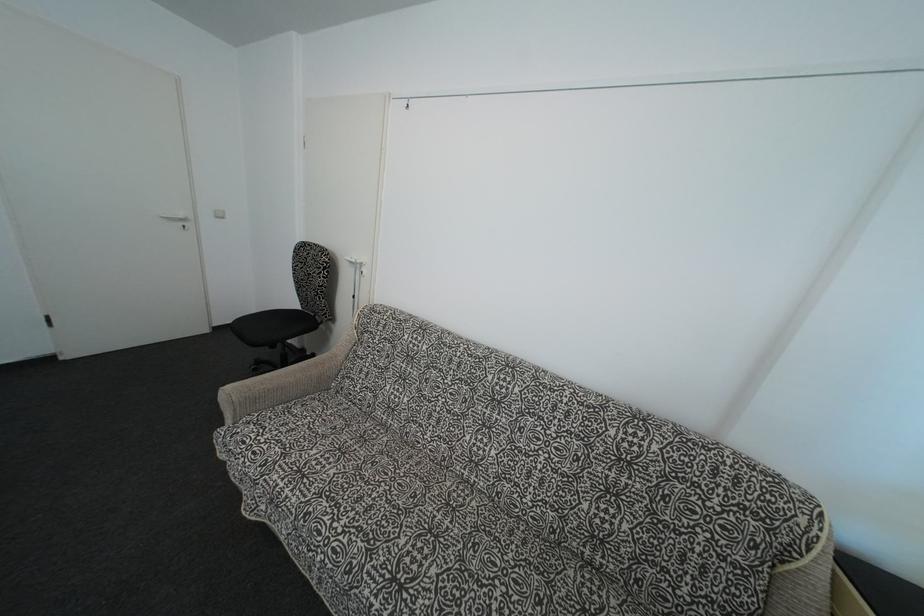
Locate an element on the screen. The image size is (924, 616). patterned sofa sitting surface is located at coordinates (369, 512).